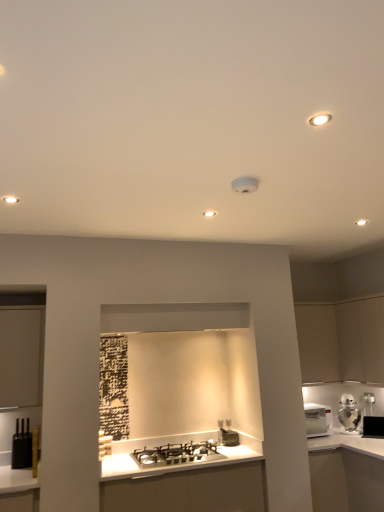
This screenshot has height=512, width=384. Describe the element at coordinates (373, 426) in the screenshot. I see `black glossy microwave at upper right, the third appliance in the front-to-back sequence` at that location.

Locate an element on the screen. This screenshot has height=512, width=384. shiny silver gas stove at center is located at coordinates (177, 454).

This screenshot has height=512, width=384. I want to click on white glossy countertop at center, so click(x=346, y=473).

Describe the element at coordinates (227, 434) in the screenshot. The image size is (384, 512). I see `metallic silver toaster at lower center, marked as the second appliance in a left-to-right arrangement` at that location.

What do you see at coordinates (346, 473) in the screenshot? I see `white glossy countertop at right` at bounding box center [346, 473].

The width and height of the screenshot is (384, 512). Find the location of `black glossy microwave at upper right, which is the 1th appliance from back to front`. black glossy microwave at upper right, which is the 1th appliance from back to front is located at coordinates (373, 426).

Identify the location of the 1st appliance in front of the black glossy microwave at upper right, marked as the first appliance in a right-to-left arrangement. (227, 434).

Can we say black glossy microwave at upper right, marked as the first appliance in a right-to-left arrangement, lies outside metallic silver toaster at lower center, which is counted as the second appliance, starting from the right?

black glossy microwave at upper right, marked as the first appliance in a right-to-left arrangement, is positioned outside metallic silver toaster at lower center, which is counted as the second appliance, starting from the right.

From a real-world perspective, is black glossy microwave at upper right, placed as the third appliance when sorted from left to right, located higher than metallic silver toaster at lower center, marked as the second appliance in a left-to-right arrangement?

No, from a real-world perspective, black glossy microwave at upper right, placed as the third appliance when sorted from left to right, is not on top of metallic silver toaster at lower center, marked as the second appliance in a left-to-right arrangement.

Is black glossy microwave at upper right, which is the 1th appliance from back to front, far away from black matte toaster at lower left, which is the 3th appliance from right to left?

Yes, black glossy microwave at upper right, which is the 1th appliance from back to front, is far from black matte toaster at lower left, which is the 3th appliance from right to left.

Choose the correct answer: Is black glossy microwave at upper right, the third appliance in the front-to-back sequence, inside black matte toaster at lower left, which is the 3th appliance from right to left, or outside it?

black glossy microwave at upper right, the third appliance in the front-to-back sequence, lies outside black matte toaster at lower left, which is the 3th appliance from right to left.

Based on the photo, is black glossy microwave at upper right, the third appliance in the front-to-back sequence, wider or thinner than black matte toaster at lower left, which is the 3th appliance in back-to-front order?

Considering their sizes, black glossy microwave at upper right, the third appliance in the front-to-back sequence, looks broader than black matte toaster at lower left, which is the 3th appliance in back-to-front order.

Can you confirm if black matte toaster at lower left, which is the 3th appliance from right to left, is bigger than white matte cabinet at right, the 1th cabinetry when ordered from right to left?

Incorrect, black matte toaster at lower left, which is the 3th appliance from right to left, is not larger than white matte cabinet at right, the 1th cabinetry when ordered from right to left.

Find the location of `the 2nd appliance counting from the left side of the white matte cabinet at right, the second cabinetry in the left-to-right sequence`. the 2nd appliance counting from the left side of the white matte cabinet at right, the second cabinetry in the left-to-right sequence is located at coordinates (22, 447).

Is black matte toaster at lower left, which appears as the first appliance when viewed from the left, looking in the opposite direction of white matte cabinet at right, the 1th cabinetry when ordered from right to left?

No, black matte toaster at lower left, which appears as the first appliance when viewed from the left, is not facing the opposite direction of white matte cabinet at right, the 1th cabinetry when ordered from right to left.

From a real-world perspective, is black matte toaster at lower left, which is the 3th appliance from right to left, positioned above or below white matte cabinet at right, the second cabinetry in the left-to-right sequence?

black matte toaster at lower left, which is the 3th appliance from right to left, is situated lower than white matte cabinet at right, the second cabinetry in the left-to-right sequence, in the real world.

Choose the correct answer: Is white matte cabinet at right, the second cabinetry in the left-to-right sequence, inside white glossy countertop at center or outside it?

The correct answer is: outside.

Considering the relative positions of white matte cabinet at right, the 1th cabinetry when ordered from right to left, and white glossy countertop at center in the image provided, is white matte cabinet at right, the 1th cabinetry when ordered from right to left, to the left of white glossy countertop at center from the viewer's perspective?

In fact, white matte cabinet at right, the 1th cabinetry when ordered from right to left, is to the right of white glossy countertop at center.

Does white matte cabinet at right, the second cabinetry in the left-to-right sequence, have a larger size compared to white glossy countertop at center?

No, white matte cabinet at right, the second cabinetry in the left-to-right sequence, is not bigger than white glossy countertop at center.

Is point (379, 298) positioned after point (380, 468)?

Yes, it is.

In the scene shown: From the image's perspective, is black matte toaster at lower left, which appears as the first appliance when viewed from the left, above shiny silver gas stove at center?

Yes.

Considering the relative positions of black matte toaster at lower left, which is the 3th appliance from right to left, and shiny silver gas stove at center in the image provided, is black matte toaster at lower left, which is the 3th appliance from right to left, to the right of shiny silver gas stove at center from the viewer's perspective?

No, black matte toaster at lower left, which is the 3th appliance from right to left, is not to the right of shiny silver gas stove at center.

Considering the relative sizes of black matte toaster at lower left, which is the 3th appliance in back-to-front order, and shiny silver gas stove at center in the image provided, is black matte toaster at lower left, which is the 3th appliance in back-to-front order, wider than shiny silver gas stove at center?

In fact, black matte toaster at lower left, which is the 3th appliance in back-to-front order, might be narrower than shiny silver gas stove at center.

Is black matte toaster at lower left, the first appliance in the front-to-back sequence, oriented away from shiny silver gas stove at center?

No.

Which is more to the right, metallic silver toaster at lower center, marked as the second appliance in a left-to-right arrangement, or shiny silver gas stove at center?

From the viewer's perspective, metallic silver toaster at lower center, marked as the second appliance in a left-to-right arrangement, appears more on the right side.

Is metallic silver toaster at lower center, which is counted as the second appliance, starting from the right, with shiny silver gas stove at center?

No.

Looking at this image, is metallic silver toaster at lower center, marked as the second appliance in a left-to-right arrangement, facing towards shiny silver gas stove at center?

No, metallic silver toaster at lower center, marked as the second appliance in a left-to-right arrangement, is not turned towards shiny silver gas stove at center.

Could you measure the distance between metallic silver toaster at lower center, which is counted as the second appliance, starting from the right, and shiny silver gas stove at center?

They are 16.34 inches apart.

Is satin nickel faucet at center shorter than white plastic electric outlet at upper right?

In fact, satin nickel faucet at center may be taller than white plastic electric outlet at upper right.

From a real-world perspective, is satin nickel faucet at center below white plastic electric outlet at upper right?

Correct, in the physical world, satin nickel faucet at center is lower than white plastic electric outlet at upper right.

Between point (219, 430) and point (367, 397), which one is positioned behind?

Point (219, 430)

From the image's perspective, which one is positioned lower, satin nickel faucet at center or white plastic electric outlet at upper right?

satin nickel faucet at center, from the image's perspective.

At what (x,y) coordinates should I click in order to perform the action: click on appliance located below the black glossy microwave at upper right, placed as the third appliance when sorted from left to right (from the image's perspective). Please return your answer as a coordinate pair (x, y). The width and height of the screenshot is (384, 512). Looking at the image, I should click on (227, 434).

Identify the location of the 2nd appliance behind the black matte toaster at lower left, which is the 3th appliance from right to left, counting from the anchor's position. This screenshot has width=384, height=512. (373, 426).

Estimate the real-world distances between objects in this image. Which object is closer to satin nickel faucet at center, black glossy microwave at upper right, marked as the first appliance in a right-to-left arrangement, or metallic silver toaster at lower center, marked as the second appliance in a left-to-right arrangement?

The object closer to satin nickel faucet at center is metallic silver toaster at lower center, marked as the second appliance in a left-to-right arrangement.

Which object lies further to the anchor point white glossy microwave at right, white glossy countertop at center or silver metallic ice bucket at right?

white glossy countertop at center lies further to white glossy microwave at right than the other object.

Which object lies further to the anchor point black glossy microwave at upper right, marked as the first appliance in a right-to-left arrangement, silver metallic ice bucket at right or metallic silver toaster at lower center, which is counted as the second appliance, starting from the right?

The object further to black glossy microwave at upper right, marked as the first appliance in a right-to-left arrangement, is metallic silver toaster at lower center, which is counted as the second appliance, starting from the right.

When comparing their distances from black glossy microwave at upper right, placed as the third appliance when sorted from left to right, does white glossy countertop at center or satin nickel faucet at center seem further?

The object further to black glossy microwave at upper right, placed as the third appliance when sorted from left to right, is satin nickel faucet at center.

Based on their spatial positions, is satin nickel faucet at center or silver metallic ice bucket at right further from matte white cabinet at right, which is the 2th cabinetry from right to left?

satin nickel faucet at center lies further to matte white cabinet at right, which is the 2th cabinetry from right to left, than the other object.

When comparing their distances from shiny silver gas stove at center, does black matte toaster at lower left, which is the 3th appliance in back-to-front order, or white glossy countertop at center seem closer?

Based on the image, black matte toaster at lower left, which is the 3th appliance in back-to-front order, appears to be nearer to shiny silver gas stove at center.

Considering their positions, is black matte toaster at lower left, which is the 3th appliance in back-to-front order, positioned closer to white glossy countertop at right than white plastic electric outlet at upper right?

Among the two, white plastic electric outlet at upper right is located nearer to white glossy countertop at right.

Estimate the real-world distances between objects in this image. Which object is closer to metallic silver toaster at lower center, which is the 2th appliance from back to front, black matte toaster at lower left, which is the 3th appliance from right to left, or white glossy countertop at center?

white glossy countertop at center is closer to metallic silver toaster at lower center, which is the 2th appliance from back to front.

The image size is (384, 512). Identify the location of kitchen appliance between metallic silver toaster at lower center, the 2th appliance viewed from the front, and white matte cabinet at right, the second cabinetry in the left-to-right sequence, from left to right. (349, 413).

Find the location of a particular element. electric outlet between white matte cabinet at right, the second cabinetry in the left-to-right sequence, and silver metallic ice bucket at right, in the vertical direction is located at coordinates (368, 398).

Find the location of a particular element. The image size is (384, 512). kitchen appliance between white glossy countertop at center and matte white cabinet at right, which is counted as the 1th cabinetry, starting from the left, from front to back is located at coordinates (349, 413).

At what (x,y) coordinates should I click in order to perform the action: click on appliance between white glossy microwave at right and white plastic electric outlet at upper right in the horizontal direction. Please return your answer as a coordinate pair (x, y). Looking at the image, I should click on (373, 426).